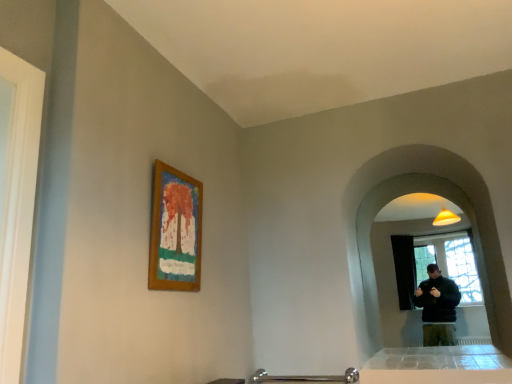
Question: In the image, is wooden frame at upper center positioned in front of or behind matte glass mirror at right?

Choices:
 (A) behind
 (B) front

Answer: (B)

Question: Considering the positions of wooden frame at upper center and matte glass mirror at right in the image, is wooden frame at upper center bigger or smaller than matte glass mirror at right?

Choices:
 (A) big
 (B) small

Answer: (B)

Question: From a real-world perspective, is wooden frame at upper center above or below matte glass mirror at right?

Choices:
 (A) below
 (B) above

Answer: (B)

Question: From a real-world perspective, is matte glass mirror at right physically located above or below wooden frame at upper center?

Choices:
 (A) below
 (B) above

Answer: (A)

Question: Would you say matte glass mirror at right is inside or outside wooden frame at upper center?

Choices:
 (A) inside
 (B) outside

Answer: (B)

Question: Does point (391, 152) appear closer or farther from the camera than point (185, 192)?

Choices:
 (A) farther
 (B) closer

Answer: (A)

Question: Considering the positions of matte glass mirror at right and wooden frame at upper center in the image, is matte glass mirror at right wider or thinner than wooden frame at upper center?

Choices:
 (A) wide
 (B) thin

Answer: (A)